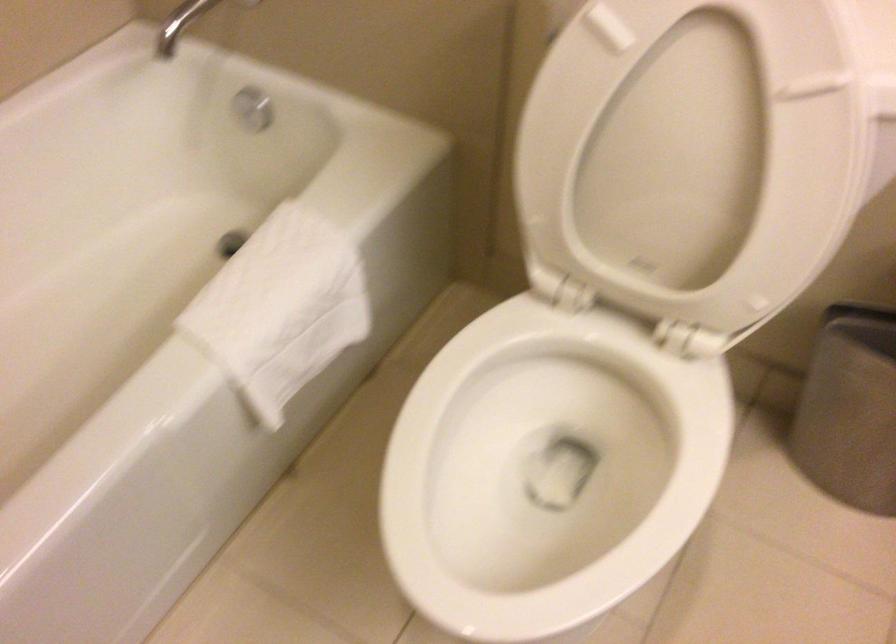
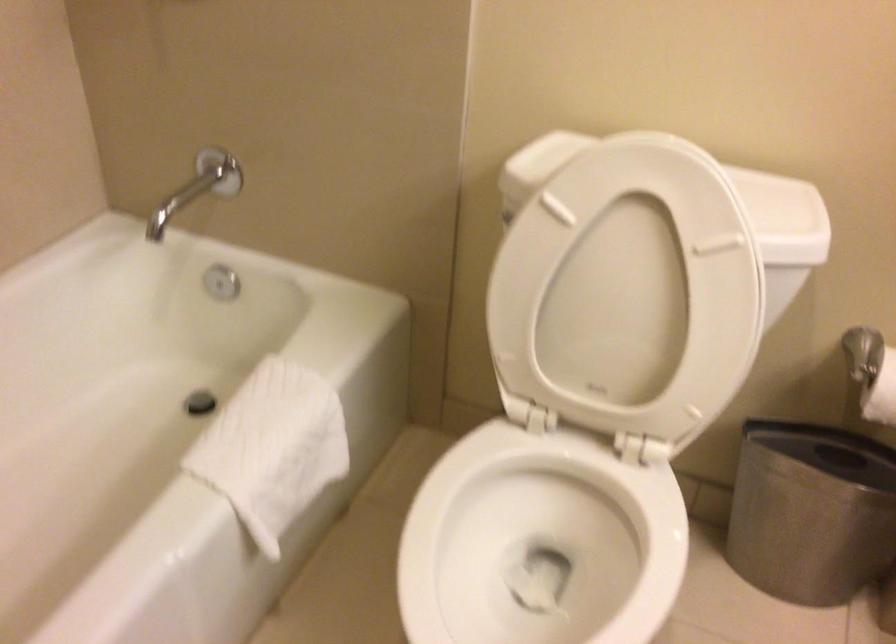
What movement of the cameraman would produce the second image?

The cameraman moved toward left, backward.